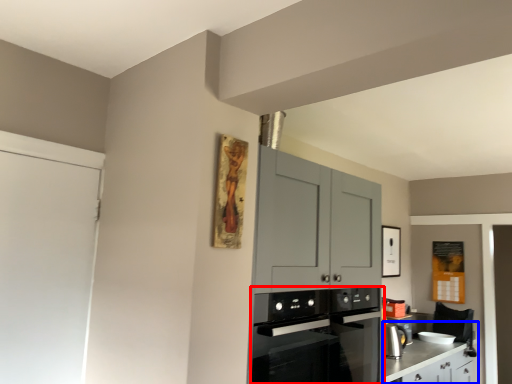
Question: Which object appears farthest to the camera in this image, kitchen appliance (highlighted by a red box) or counter (highlighted by a blue box)?

Choices:
 (A) kitchen appliance
 (B) counter

Answer: (B)